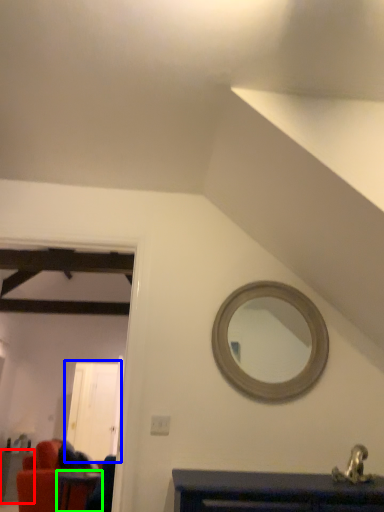
Question: Which is nearer to the table (highlighted by a red box)? glass door (highlighted by a blue box) or table (highlighted by a green box).

Choices:
 (A) glass door
 (B) table

Answer: (B)